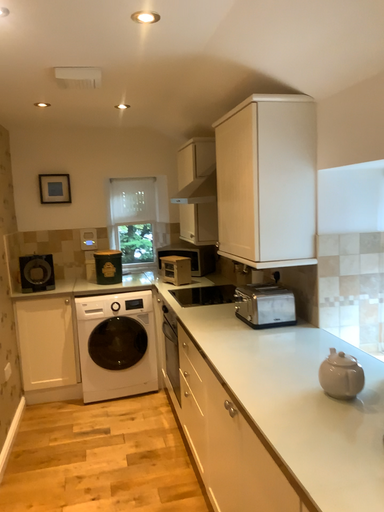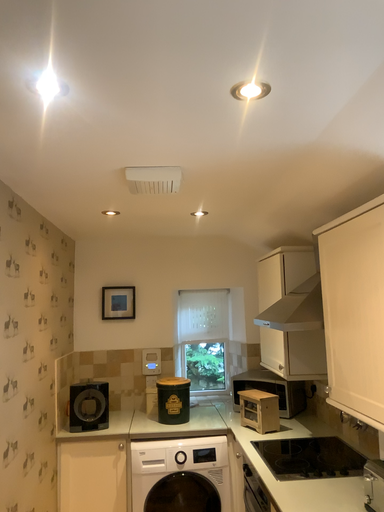
Question: Which way did the camera rotate in the video?

Choices:
 (A) rotated left
 (B) rotated right

Answer: (A)